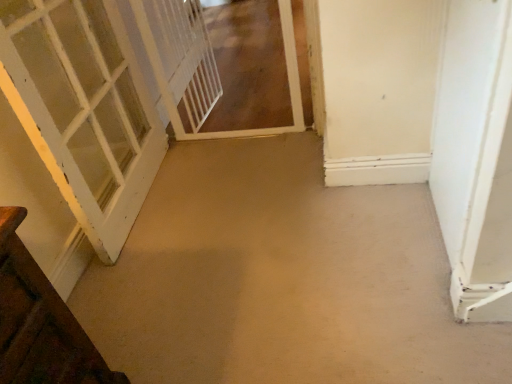
Identify the location of free space between white painted wood door at left, which is the third door in right-to-left order, and white matte door at right, which is counted as the 3th door, starting from the left. The image size is (512, 384). (272, 216).